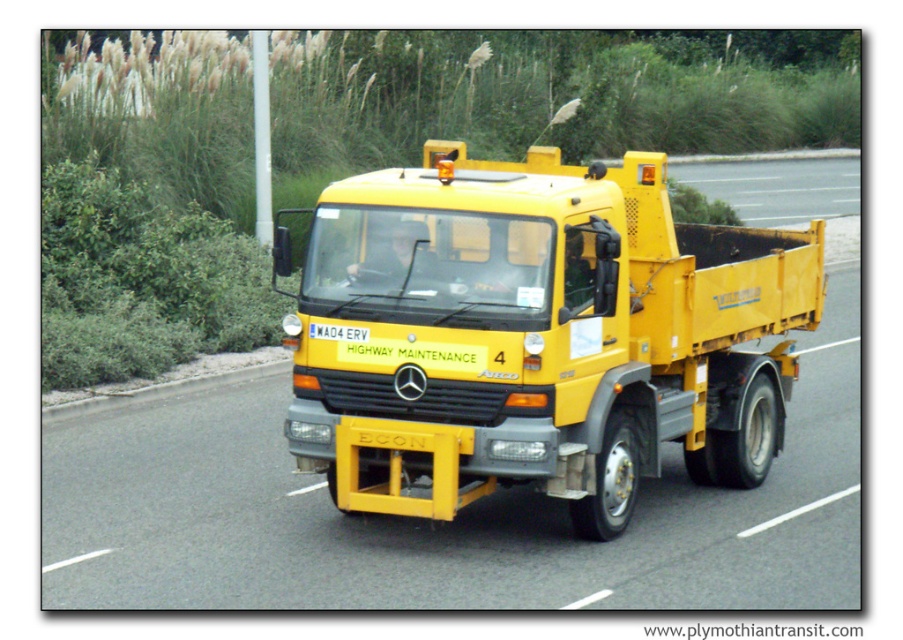
Is yellow matte truck at center taller than yellow asphalt road at center?

No, yellow matte truck at center is not taller than yellow asphalt road at center.

Is point (485, 324) closer to viewer compared to point (695, 173)?

Yes, point (485, 324) is closer to viewer.

What are the coordinates of `yellow matte truck at center` in the screenshot? It's located at (536, 336).